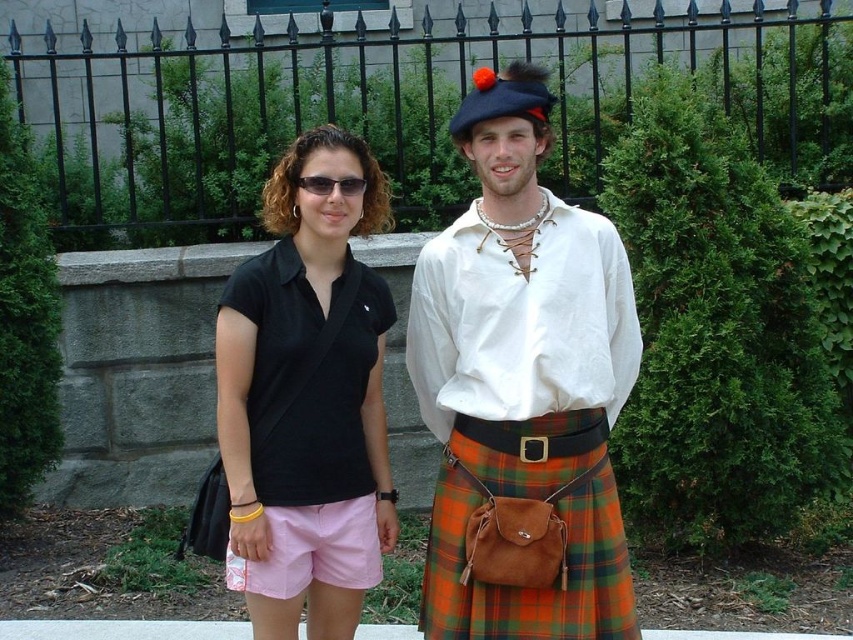
Looking at this image, you are a photographer trying to capture the two people in the scene. You notice the matte white shirt at center and the plaid wool kilt at center. Which one is located to the right of the other?

The matte white shirt at center is positioned on the right side of plaid wool kilt at center.

Based on the photo, you are a photographer taking a portrait of the two people in the scene. You want to ensure that both the matte white shirt at center and the pink cotton shorts at center are clearly visible in the frame. Given their current positions, is there enough space between them to focus on both items without one overlapping the other?

The matte white shirt at center and pink cotton shorts at center are 27.00 inches apart, which provides sufficient space to capture both items in the frame without overlapping.

What are the coordinates of the black matte shirt at center?

The black matte shirt at center is located at point (306,401).